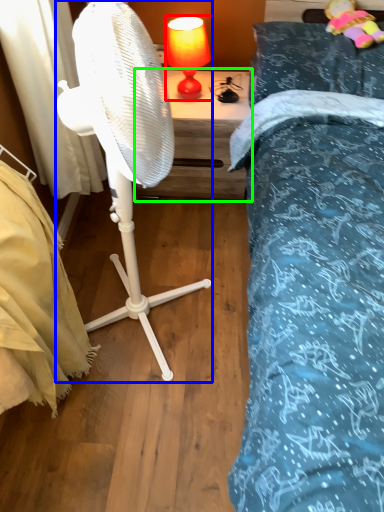
Question: Which is farther away from table lamp (highlighted by a red box)? mechanical fan (highlighted by a blue box) or nightstand (highlighted by a green box)?

Choices:
 (A) mechanical fan
 (B) nightstand

Answer: (A)